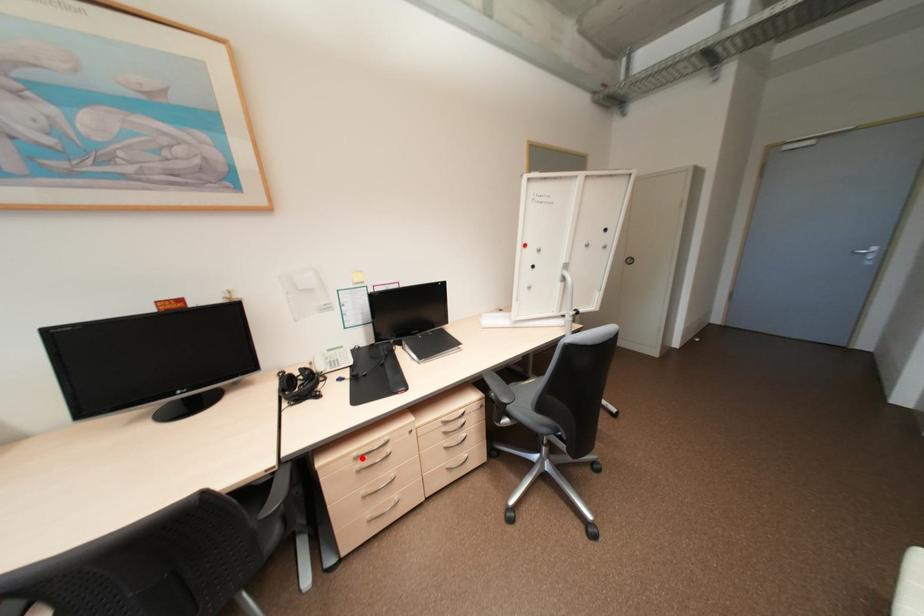
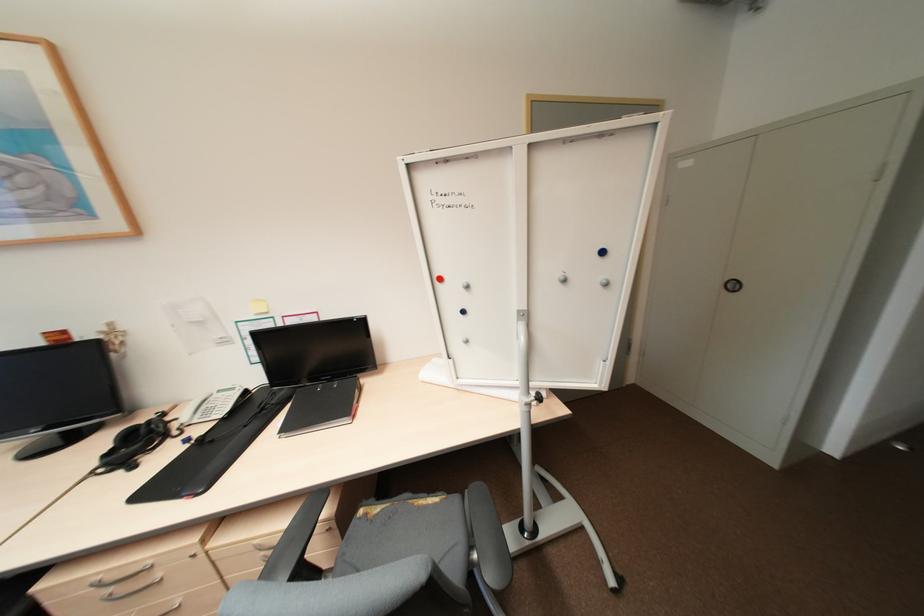
Question: A red point is marked in image1. In image2, is the corresponding 3D point closer to the camera or farther? Reply with the corresponding letter.

Choices:
 (A) The corresponding 3D point is closer.
 (B) The corresponding 3D point is farther.

Answer: (A)